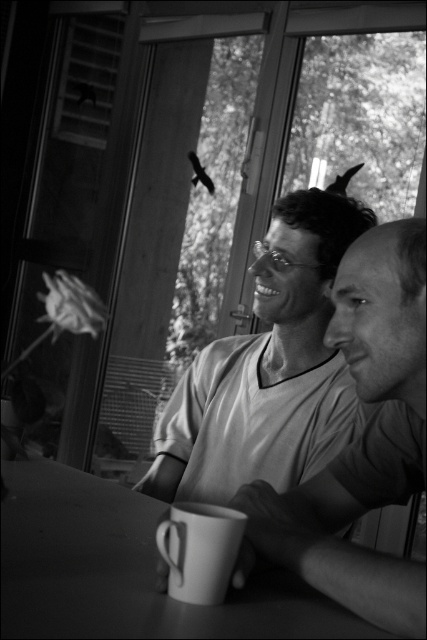
You are trying to locate the smooth white shirt at center in the black and white photograph. Based on the coordinates provided in the description, where would you expect to find it relative to the two individuals?

The smooth white shirt at center is located at point 0.686 on the x axis and 0.852 on the y axis, which places it near the lower right area of the image relative to the two individuals seated near the window.

Based on the scene description, where is the point at coordinates (126,570) located?

The point at coordinates (126,570) corresponds to the smooth matte table at center.